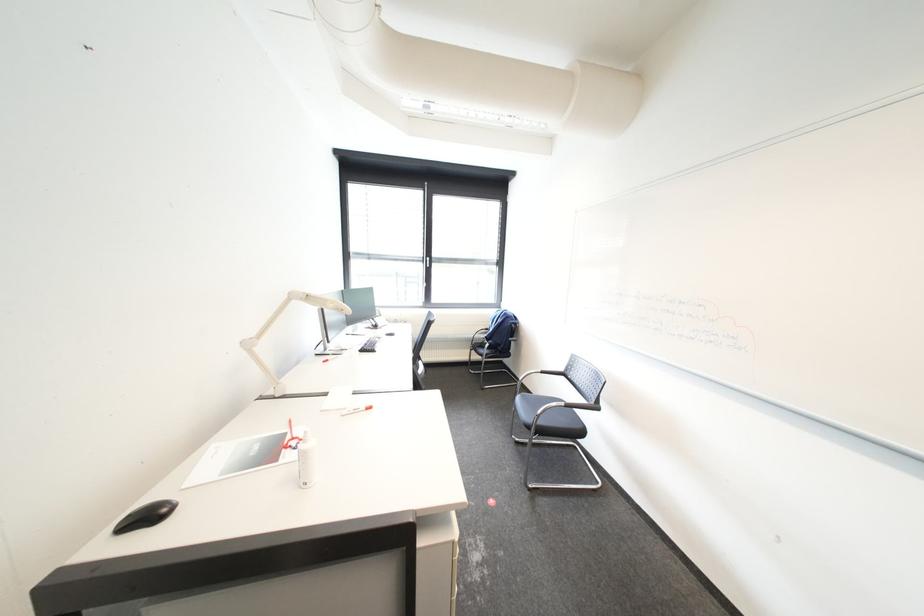
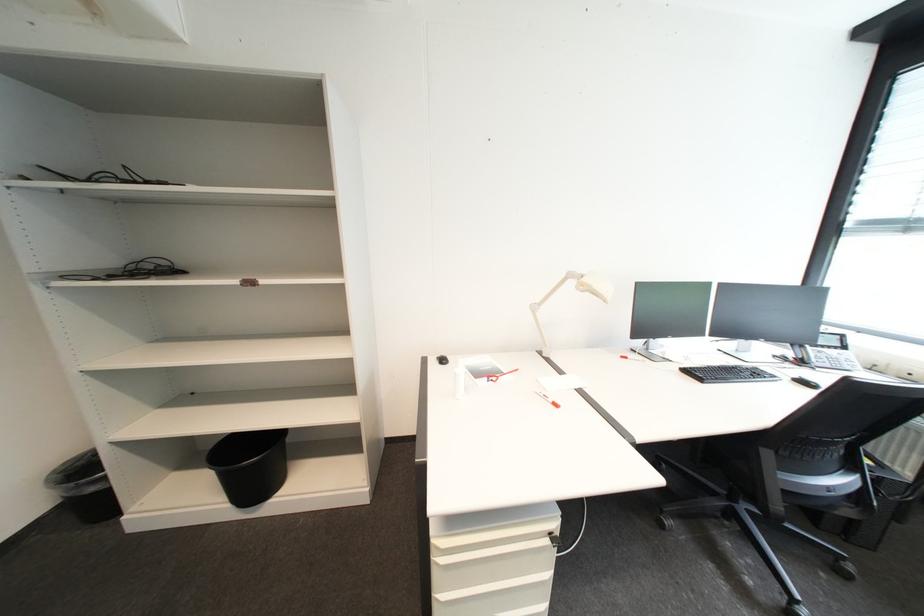
Question: The camera is either moving clockwise (left) or counter-clockwise (right) around the object. The first image is from the beginning of the video and the second image is from the end. Is the camera moving left or right when shooting the video?

Choices:
 (A) Left
 (B) Right

Answer: (B)